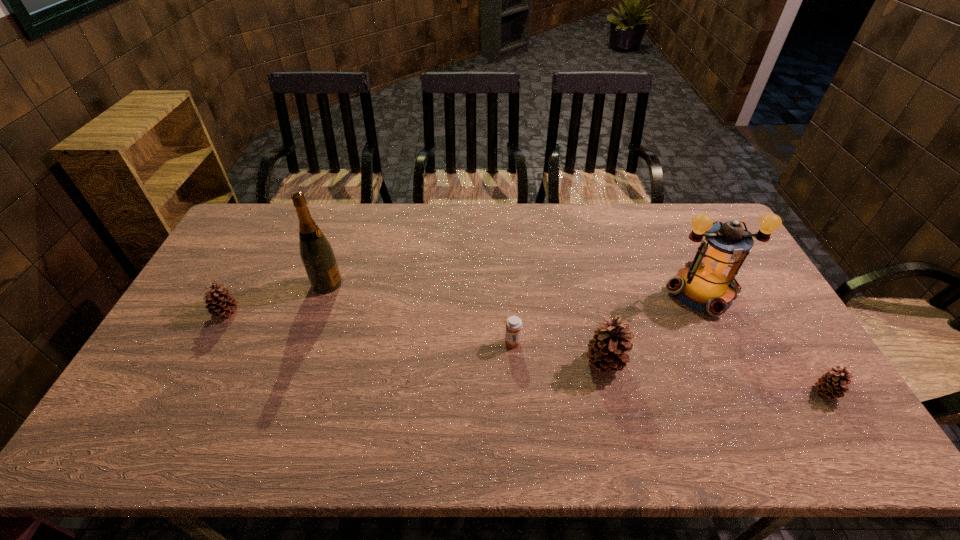
You are a GUI agent. You are given a task and a screenshot of the screen. Output one action in this format:
    pyautogui.click(x=<x>, y=<y>)
    Task: Click on the vacant point located between the lantern and the tallest pinecone
    The width and height of the screenshot is (960, 540).
    Given the screenshot: What is the action you would take?
    654,327

Locate an element on the screen. The height and width of the screenshot is (540, 960). free space that is in between the farthest pinecone and the nearest object is located at coordinates (526, 353).

Image resolution: width=960 pixels, height=540 pixels. Identify the location of free point between the shortest pinecone and the leftmost object. (526, 353).

At what (x,y) coordinates should I click in order to perform the action: click on vacant space in between the tallest pinecone and the lantern. Please return your answer as a coordinate pair (x, y). Looking at the image, I should click on (654, 327).

The height and width of the screenshot is (540, 960). What are the coordinates of `vacant space that is in between the fifth object from right to left and the shortest pinecone` in the screenshot? It's located at (577, 338).

Locate which object ranks in proximity to the medicine. Please provide its 2D coordinates. Your answer should be formatted as a tuple, i.e. [(x, y)], where the tuple contains the x and y coordinates of a point satisfying the conditions above.

[(606, 350)]

The image size is (960, 540). In order to click on object that is the closest to the fourth object from right to left in this screenshot , I will do `click(606, 350)`.

Identify which pinecone is the third closest to the second object from right to left. Please provide its 2D coordinates. Your answer should be formatted as a tuple, i.e. [(x, y)], where the tuple contains the x and y coordinates of a point satisfying the conditions above.

[(220, 303)]

Find the location of a particular element. The image size is (960, 540). pinecone that is the nearest to the second tallest object is located at coordinates (606, 350).

Locate an element on the screen. This screenshot has width=960, height=540. vacant position in the image that satisfies the following two spatial constraints: 1. on the front-facing side of the shortest pinecone; 2. on the left side of the second object from left to right is located at coordinates (290, 393).